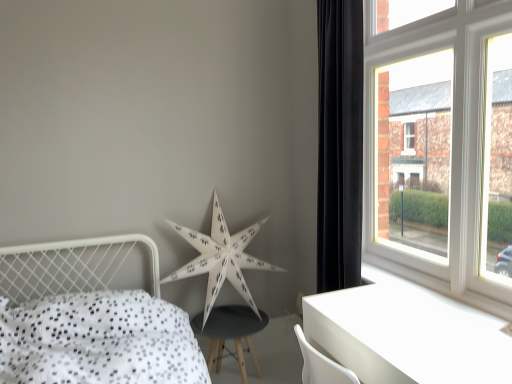
Question: Is white wooden window at upper right in front of white dotted fabric bed at lower left?

Choices:
 (A) no
 (B) yes

Answer: (A)

Question: Can you confirm if white wooden window at upper right is thinner than white dotted fabric bed at lower left?

Choices:
 (A) no
 (B) yes

Answer: (B)

Question: Considering the relative sizes of white wooden window at upper right and white dotted fabric bed at lower left in the image provided, is white wooden window at upper right taller than white dotted fabric bed at lower left?

Choices:
 (A) no
 (B) yes

Answer: (B)

Question: Is white wooden window at upper right positioned far away from white dotted fabric bed at lower left?

Choices:
 (A) no
 (B) yes

Answer: (B)

Question: From a real-world perspective, is white wooden window at upper right physically above white dotted fabric bed at lower left?

Choices:
 (A) yes
 (B) no

Answer: (A)

Question: Can you confirm if white wooden window at upper right is wider than white dotted fabric bed at lower left?

Choices:
 (A) yes
 (B) no

Answer: (B)

Question: Does white wooden window at upper right come behind white paper star at center?

Choices:
 (A) yes
 (B) no

Answer: (B)

Question: Is white wooden window at upper right taller than white paper star at center?

Choices:
 (A) no
 (B) yes

Answer: (B)

Question: Does white wooden window at upper right lie in front of white paper star at center?

Choices:
 (A) yes
 (B) no

Answer: (A)

Question: Considering the relative sizes of white wooden window at upper right and white paper star at center in the image provided, is white wooden window at upper right thinner than white paper star at center?

Choices:
 (A) yes
 (B) no

Answer: (A)

Question: From a real-world perspective, is white wooden window at upper right on top of white paper star at center?

Choices:
 (A) no
 (B) yes

Answer: (B)

Question: Considering the relative sizes of white wooden window at upper right and white paper star at center in the image provided, is white wooden window at upper right shorter than white paper star at center?

Choices:
 (A) no
 (B) yes

Answer: (A)

Question: Is the position of black velvet curtain at right less distant than that of white glossy table at lower right?

Choices:
 (A) no
 (B) yes

Answer: (A)